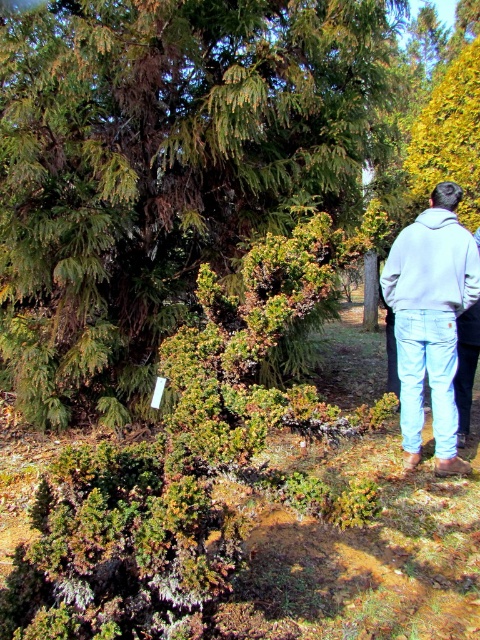
Question: Which point is farther to the camera?

Choices:
 (A) (39, 204)
 (B) (444, 340)
 (C) (158, 512)

Answer: (A)

Question: Based on their relative distances, which object is farther from the green leafy tree at upper left?

Choices:
 (A) light gray hoodie at upper right
 (B) sweatshirt at right

Answer: (A)

Question: Estimate the real-world distances between objects in this image. Which object is farther from the light gray hoodie at upper right?

Choices:
 (A) green leafy tree at upper left
 (B) sweatshirt at right
 (C) green textured bush at center

Answer: (C)

Question: Does green leafy tree at upper left have a greater width compared to green textured bush at center?

Choices:
 (A) no
 (B) yes

Answer: (B)

Question: Does green leafy tree at upper left appear on the right side of sweatshirt at right?

Choices:
 (A) yes
 (B) no

Answer: (B)

Question: Where is green leafy tree at upper left located in relation to green textured bush at center in the image?

Choices:
 (A) right
 (B) left

Answer: (B)